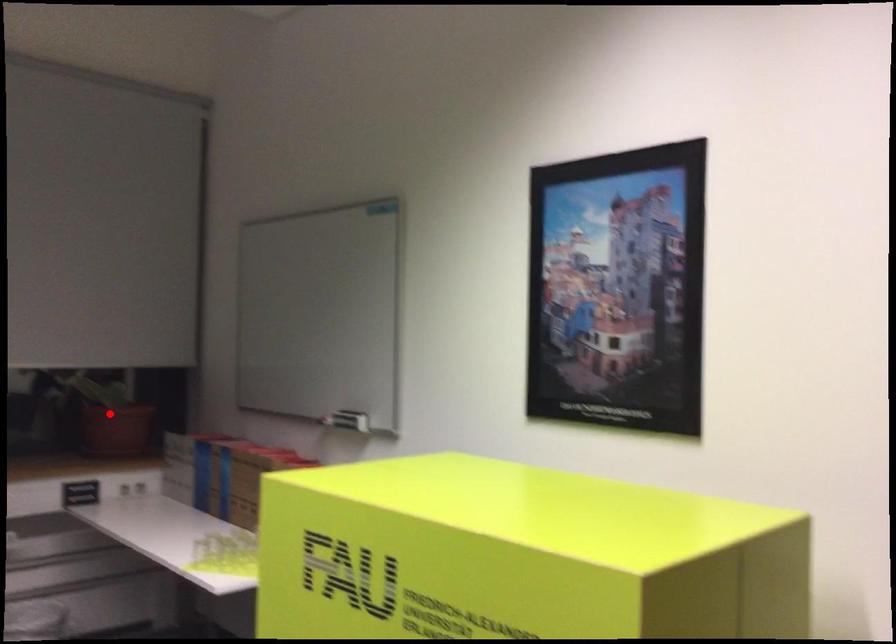
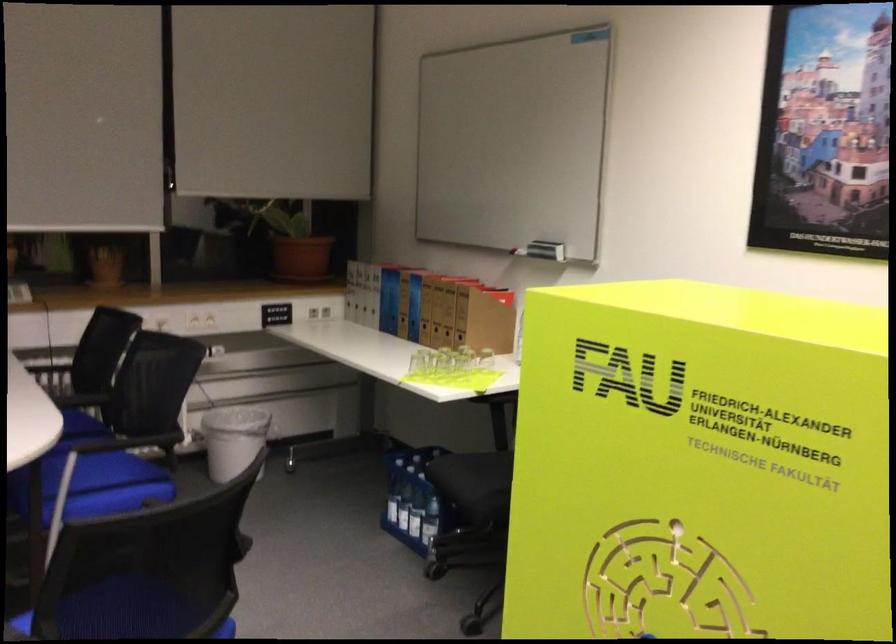
Locate, in the second image, the point that corresponds to the highlighted location in the first image.

(294, 243)